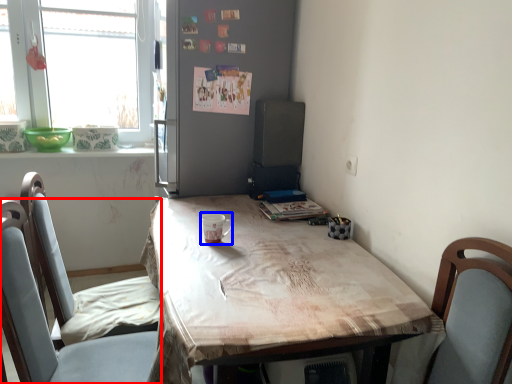
Question: Which object appears farthest to the camera in this image, chair (highlighted by a red box) or coffee cup (highlighted by a blue box)?

Choices:
 (A) chair
 (B) coffee cup

Answer: (B)